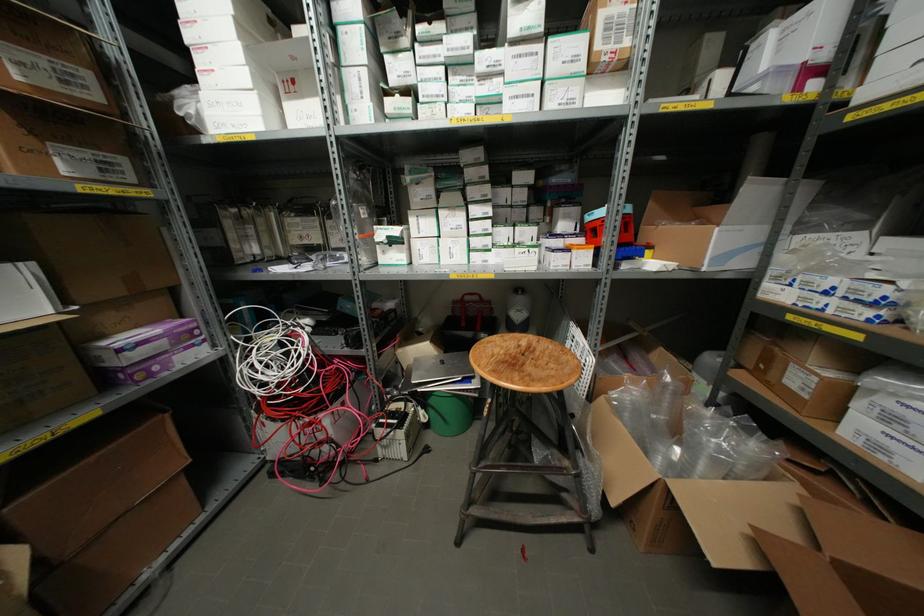
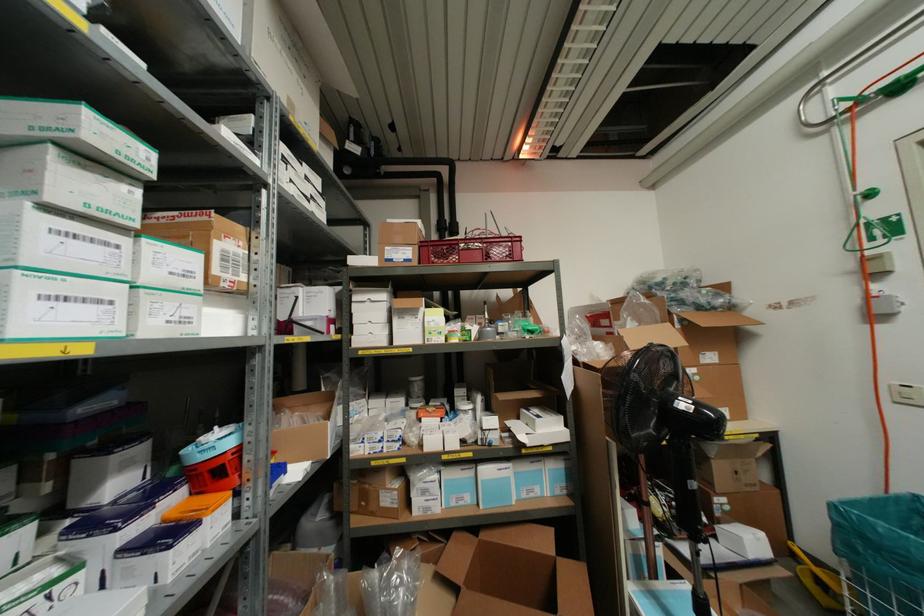
Where in the second image is the point corresponding to the point at 527,95 from the first image?

(98, 301)